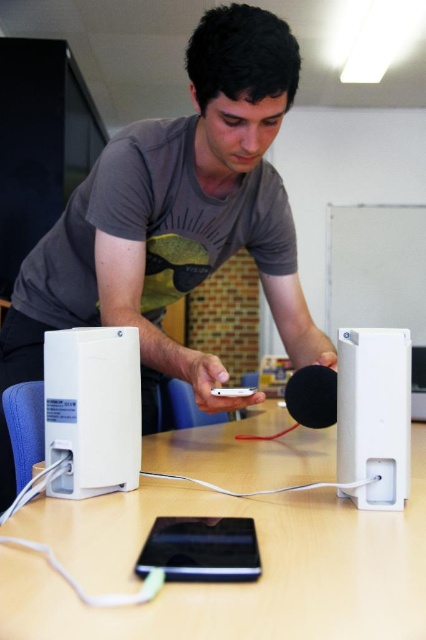
You are setting up an audio system and need to connect the white matte speaker at center to the satin silver ipod at center. According to the image, where should you place the white matte speaker relative to the ipod?

The white matte speaker at center should be placed below the satin silver ipod at center as per the image description.

You are setting up a presentation and need to place a 15 cm tall book on the table. Given the white plastic table at center and the white matte speaker at center, which object can support the book without it falling over?

The white plastic table at center can support the book since it is shorter than the white matte speaker at center, implying it has a stable surface for placing items.